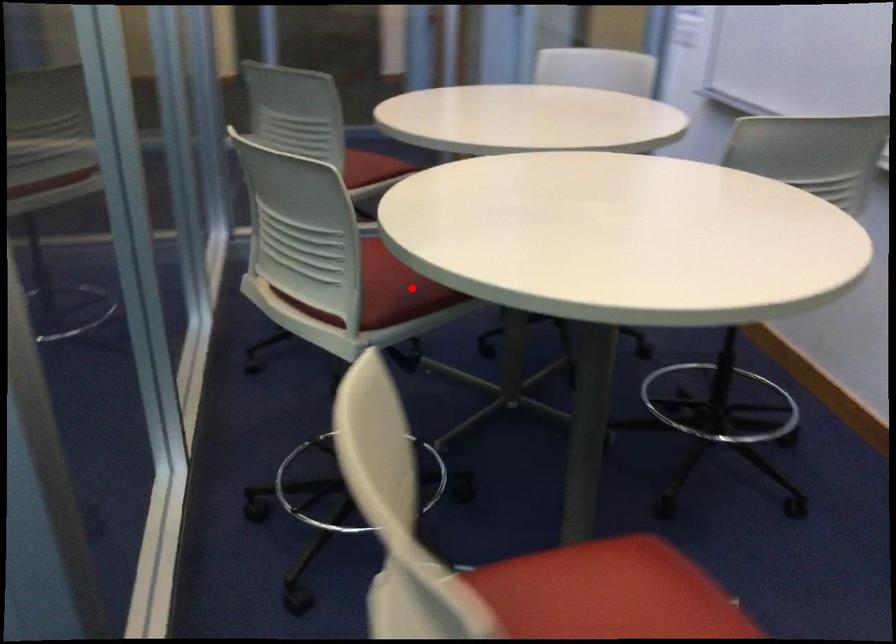
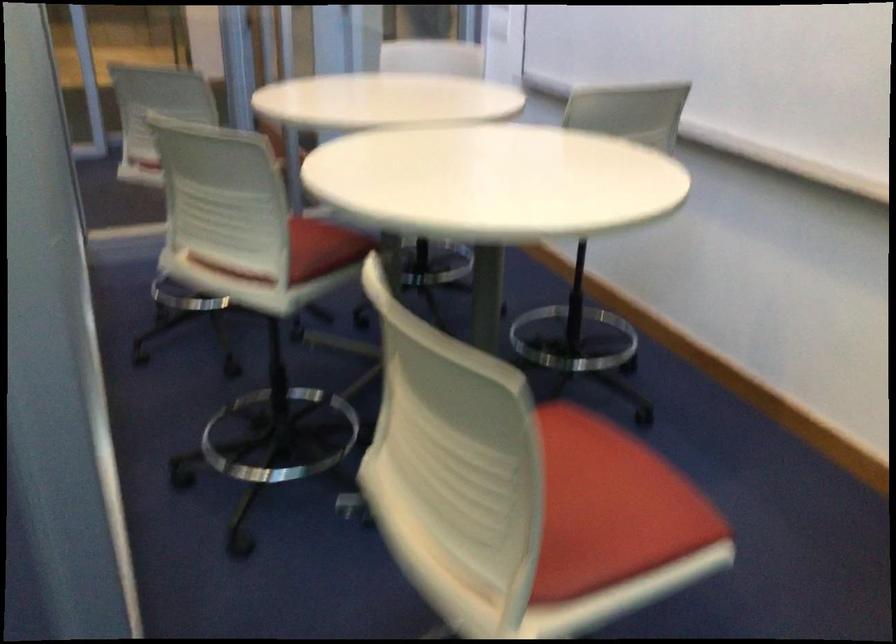
Question: I am providing you with two images of the same scene from different viewpoints. A red point is shown in image1. For the corresponding object point in image2, is it positioned nearer or farther from the camera?

Choices:
 (A) Nearer
 (B) Farther

Answer: (B)